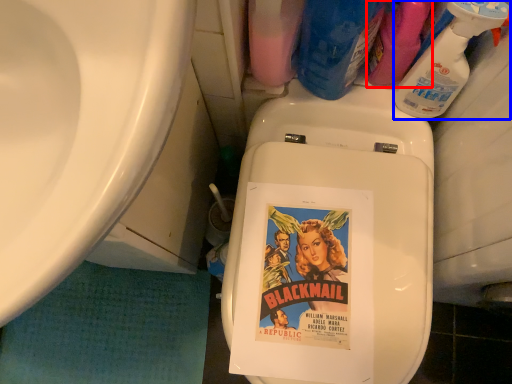
Question: Which of the following is the farthest to the observer, cleaning product (highlighted by a red box) or cleaning product (highlighted by a blue box)?

Choices:
 (A) cleaning product
 (B) cleaning product

Answer: (A)